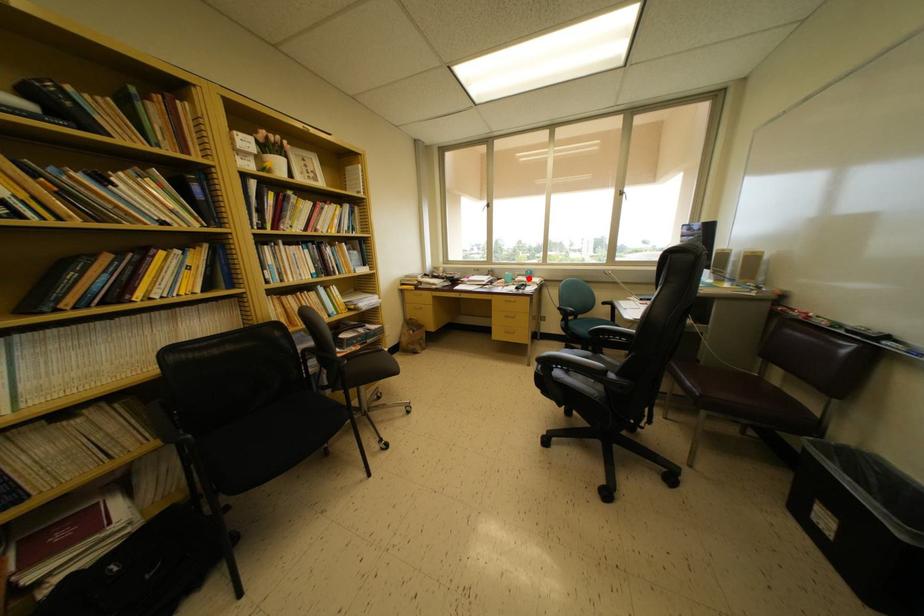
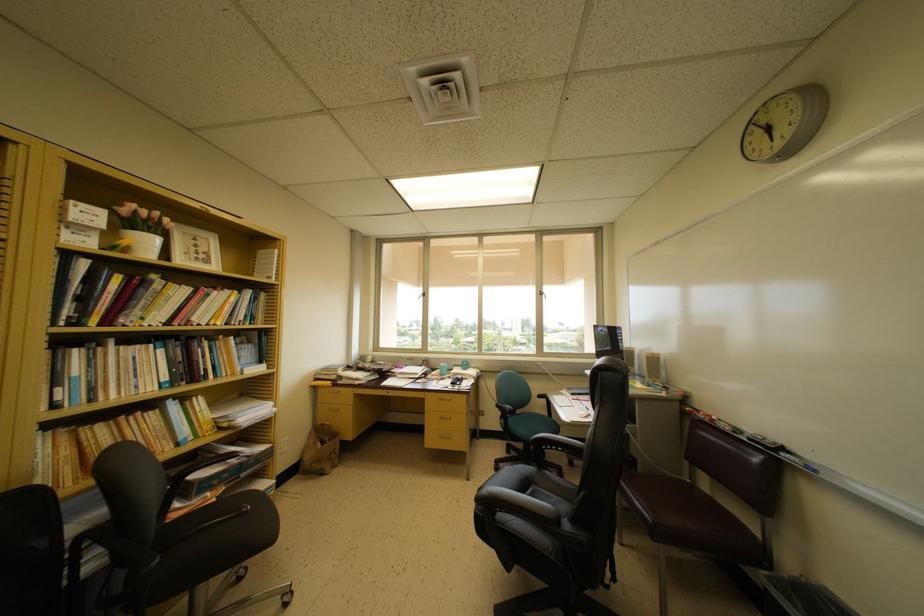
Question: A red point is marked in image1. In image2, is the corresponding 3D point closer to the camera or farther? Reply with the corresponding letter.

Choices:
 (A) The corresponding 3D point is closer.
 (B) The corresponding 3D point is farther.

Answer: (B)